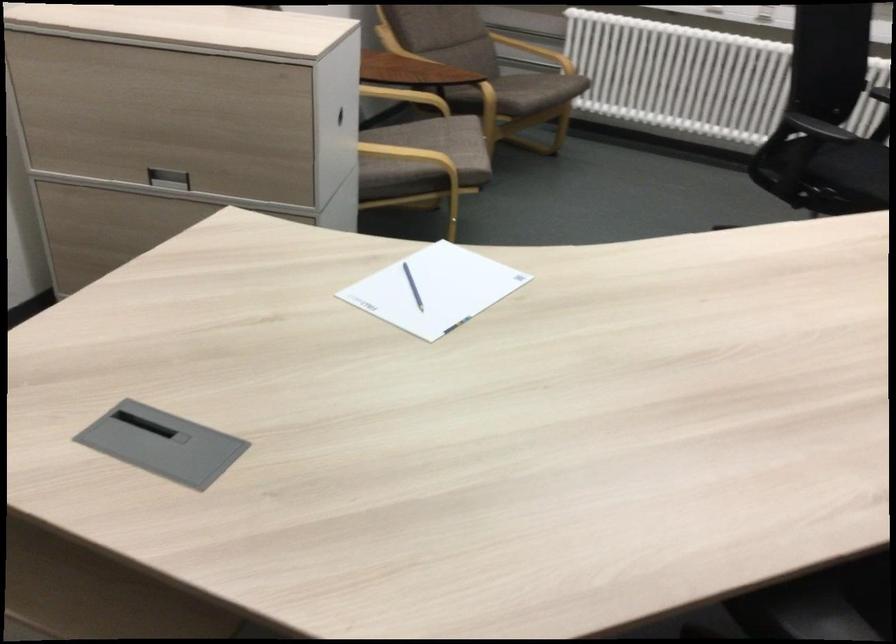
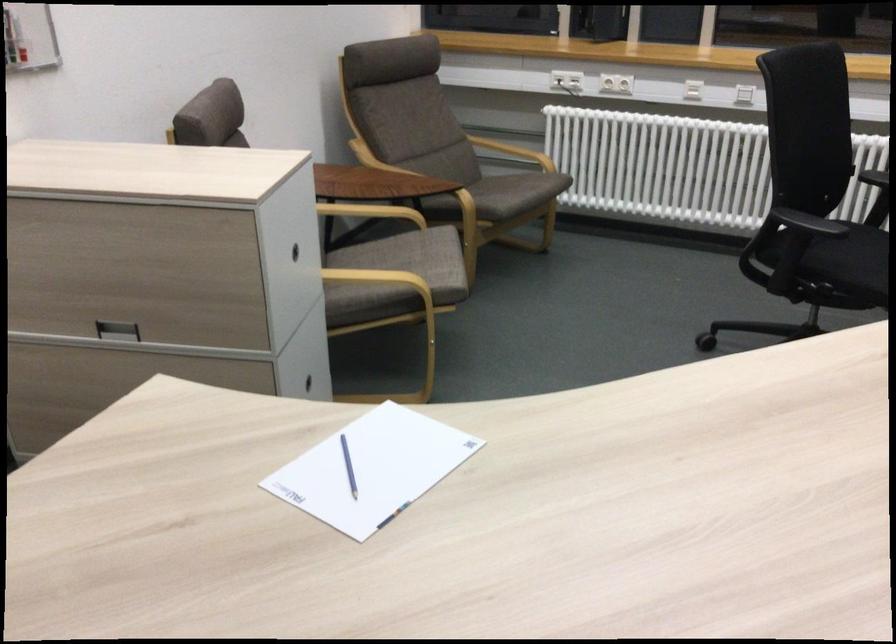
Where in the second image is the point corresponding to the point at 406,289 from the first image?

(348, 466)